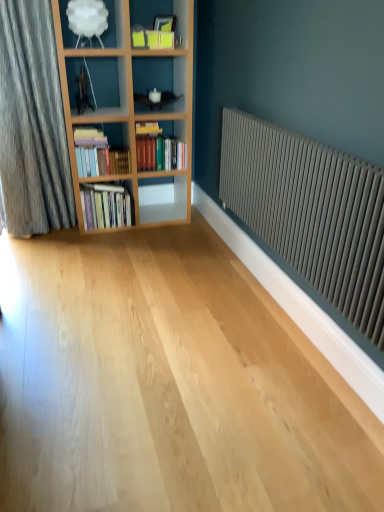
Image resolution: width=384 pixels, height=512 pixels. Identify the location of free space in front of hardcover books at left, marked as the 1th book in a bottom-to-top arrangement. (102, 236).